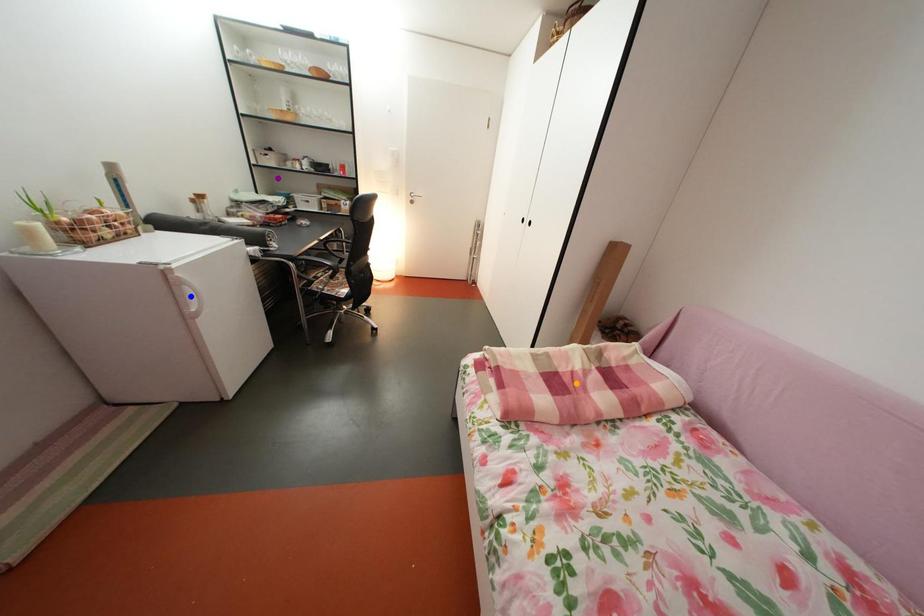
Order these from farthest to nearest:
blue point | purple point | orange point

purple point, orange point, blue point